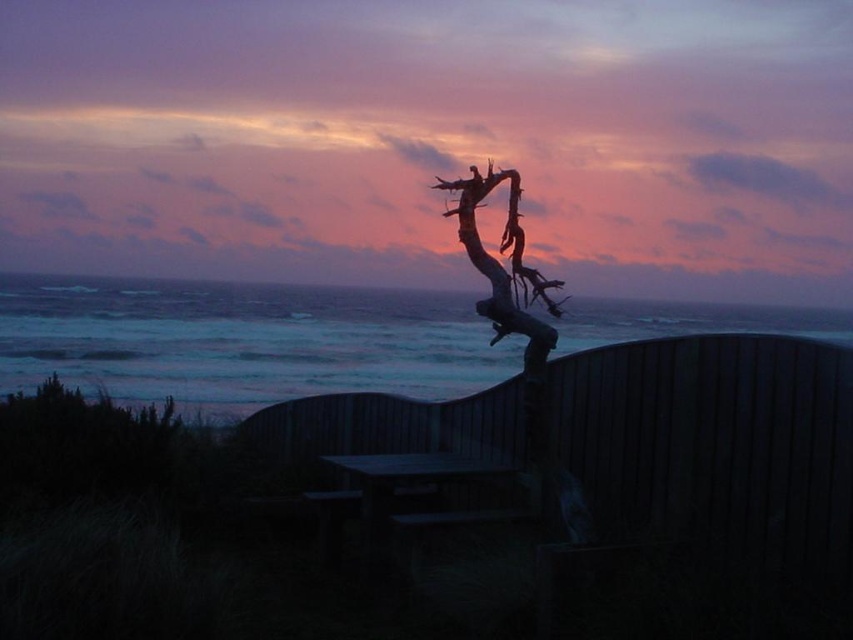
You are standing on the wooden deck observing the coastal scene. You notice the blue water at upper center. Can you determine its exact position in the image using coordinates?

The blue water at upper center is located at point coordinates (242, 340).

You are standing on the wooden deck and looking out at the blue water at upper center and the wooden driftwood at center. Which object appears larger in the scene?

The blue water at upper center appears larger because it is taller than the wooden driftwood at center.

You are standing on the wooden deck with the curved railing and want to place a 10 feet long wooden bench between the blue water at upper center and the weathered tree branch leaning against the railing. Can the bench fit in that space?

The space between the blue water at upper center and the weathered tree branch leaning against the railing is 19.32 feet, so yes, the 10 feet long wooden bench can fit in that space since it is shorter than the available distance.